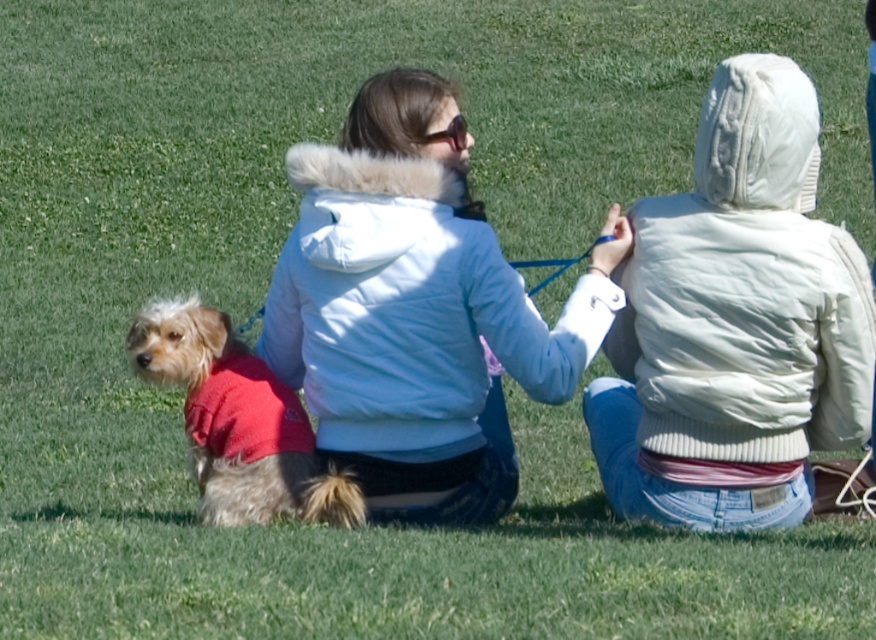
You are a photographer trying to capture a photo of the light blue puffy jacket at center and the white fuzzy jacket at upper right. Since you want both subjects to be in focus, you need to know their vertical positions. Which jacket is lower in the image?

The white fuzzy jacket at upper right is below the light blue puffy jacket at center, so the white fuzzy jacket at upper right is lower in the image.

You are a photographer trying to capture both the white fuzzy jacket at upper right and the light blue puffy jacket at center in a single frame. Given that your camera has a fixed focus that can only clearly capture objects of a certain width, which jacket should you focus on to ensure it appears clearer in the photo?

The white fuzzy jacket at upper right has a lesser width compared to the light blue puffy jacket at center, so focusing on the white fuzzy jacket at upper right would ensure it appears clearer since smaller objects are easier to focus on with a fixed focus camera.